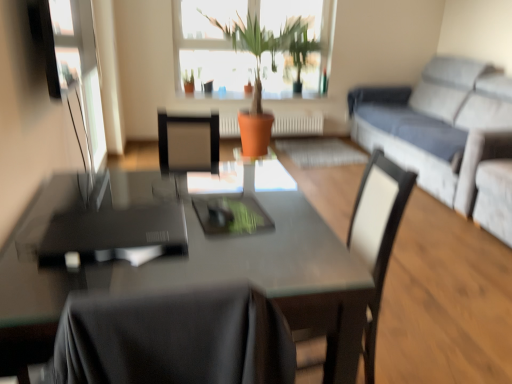
Find the location of `empty space that is ontop of glossy glass table at center (from a real-world perspective)`. empty space that is ontop of glossy glass table at center (from a real-world perspective) is located at coordinates (174, 223).